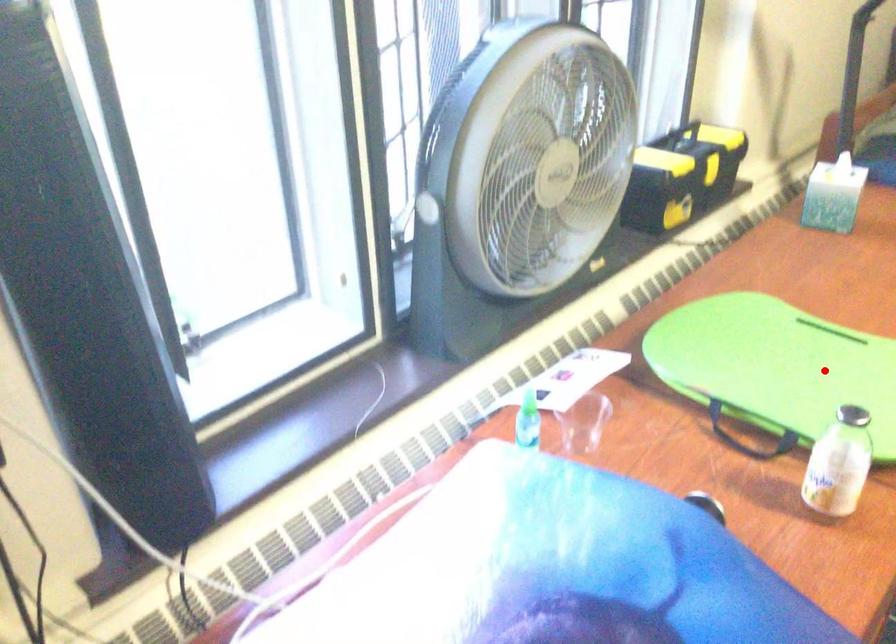
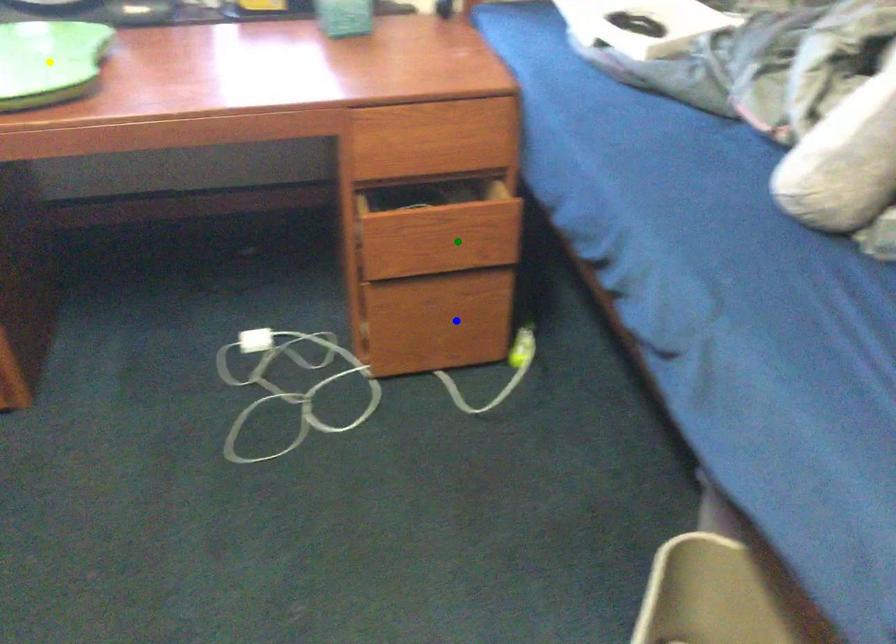
Question: I am providing you with two images of the same scene from different viewpoints. A red point is marked on the first image. You are given multiple points on the second image. Can you choose the point in image 2 that corresponds to the point in image 1?

Choices:
 (A) yellow point
 (B) blue point
 (C) green point

Answer: (A)